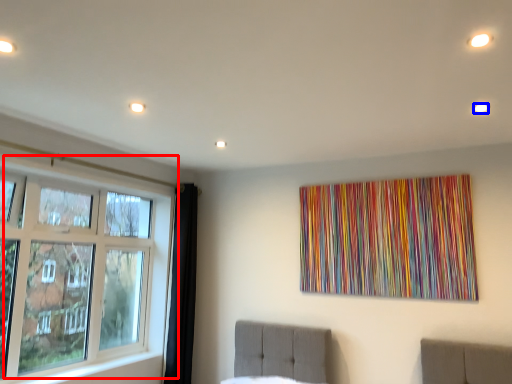
Question: Which object is closer to the camera taking this photo, window (highlighted by a red box) or light (highlighted by a blue box)?

Choices:
 (A) window
 (B) light

Answer: (B)